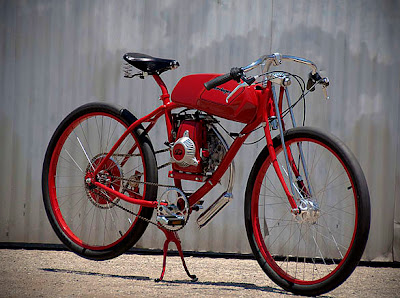
The height and width of the screenshot is (298, 400). Identify the location of seats. (145, 63).